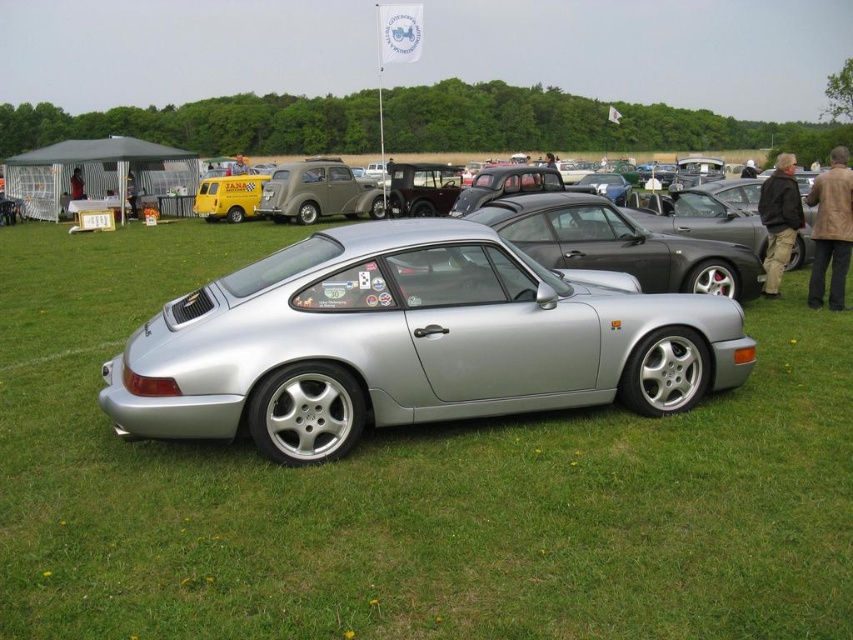
From the picture: Can you confirm if silver metallic car at center is positioned below matte gray sedan at center?

Indeed, silver metallic car at center is positioned under matte gray sedan at center.

Does silver metallic car at center have a smaller size compared to matte gray sedan at center?

Indeed, silver metallic car at center has a smaller size compared to matte gray sedan at center.

Between point (265, 403) and point (373, 184), which one is positioned behind?

The point (373, 184) is behind.

Locate an element on the screen. This screenshot has width=853, height=640. silver metallic car at center is located at coordinates (410, 342).

Which is in front, point (45, 353) or point (184, 419)?

Point (184, 419) is more forward.

This screenshot has height=640, width=853. What do you see at coordinates (407, 490) in the screenshot? I see `green grass at center` at bounding box center [407, 490].

Find the location of a particular element. green grass at center is located at coordinates (407, 490).

In the scene shown: Who is more distant from viewer, (x=314, y=556) or (x=334, y=157)?

The point (x=334, y=157) is behind.

Does green grass at center have a lesser width compared to matte gray sedan at center?

Incorrect, green grass at center's width is not less than matte gray sedan at center's.

You are a GUI agent. You are given a task and a screenshot of the screen. Output one action in this format:
    pyautogui.click(x=<x>, y=<y>)
    Task: Click on the green grass at center
    Image resolution: width=853 pixels, height=640 pixels.
    Given the screenshot: What is the action you would take?
    [x=407, y=490]

Find the location of `green grass at center`. green grass at center is located at coordinates (407, 490).